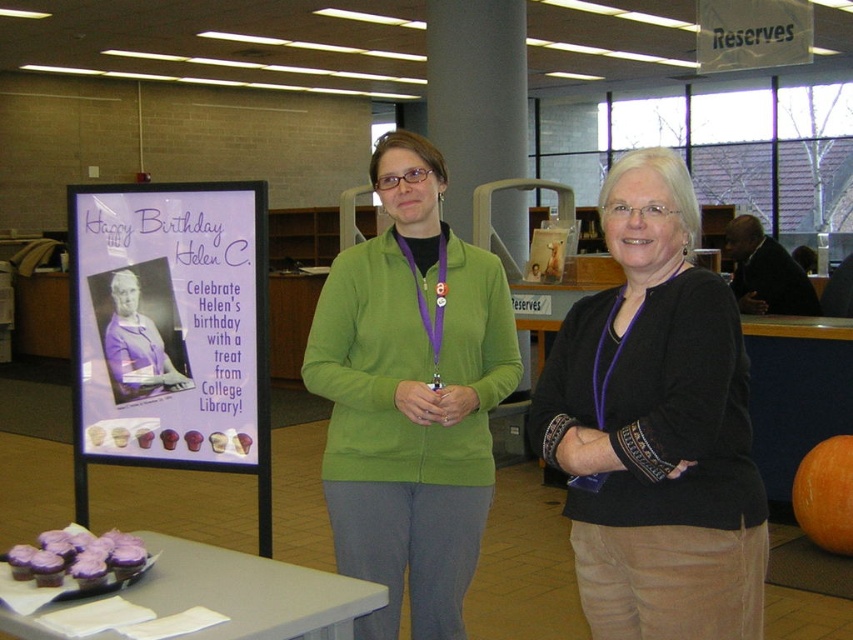
Can you confirm if black matte sweater at center is smaller than purple fabric at center?

A: Incorrect, black matte sweater at center is not smaller in size than purple fabric at center.

The image size is (853, 640). Describe the element at coordinates (654, 428) in the screenshot. I see `black matte sweater at center` at that location.

Who is more distant from viewer, (636,433) or (126,380)?

The point (126,380) is behind.

Find the location of a particular element. This screenshot has width=853, height=640. black matte sweater at center is located at coordinates (654, 428).

Does purple paper poster at upper left appear on the left side of purple frosted cupcakes at lower left?

Yes, purple paper poster at upper left is to the left of purple frosted cupcakes at lower left.

Is purple paper poster at upper left shorter than purple frosted cupcakes at lower left?

No.

The height and width of the screenshot is (640, 853). What are the coordinates of `purple paper poster at upper left` in the screenshot? It's located at (167, 323).

Can you confirm if green fabric sweater at center is positioned to the right of purple fabric at center?

Yes, green fabric sweater at center is to the right of purple fabric at center.

Is green fabric sweater at center shorter than purple fabric at center?

No, green fabric sweater at center is not shorter than purple fabric at center.

Locate an element on the screen. The image size is (853, 640). green fabric sweater at center is located at coordinates (656, 428).